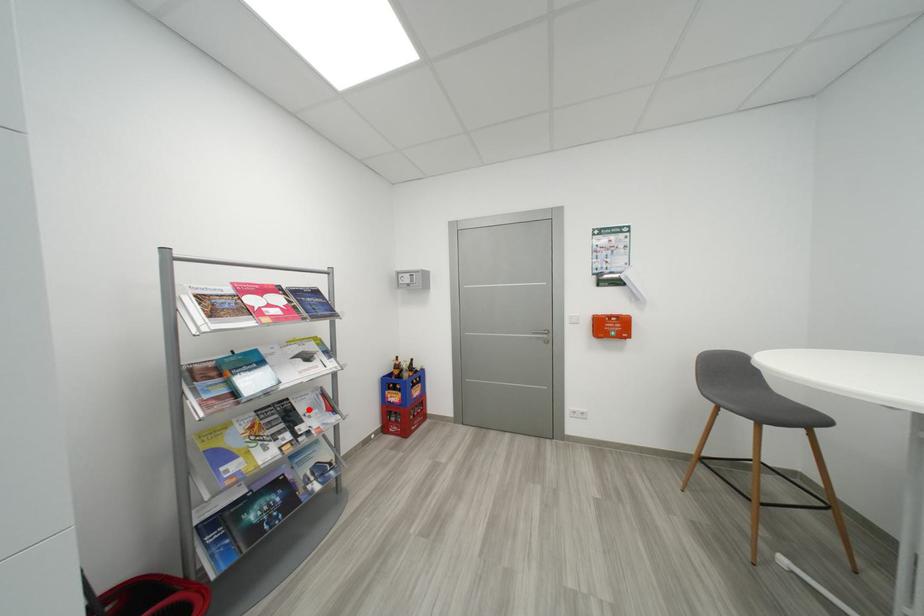
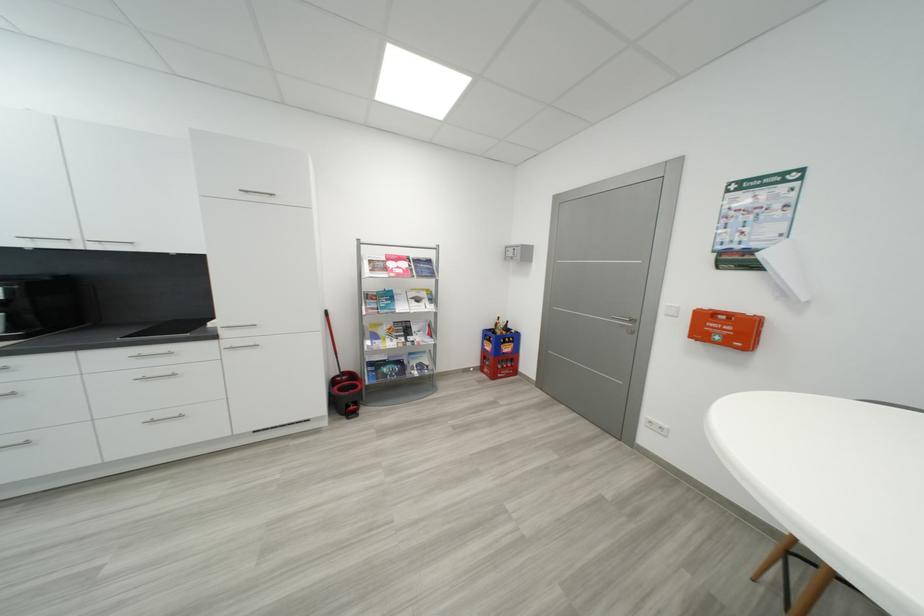
Question: I am providing you with two images of the same scene from different viewpoints. A red point is shown in image1. For the corresponding object point in image2, is it positioned nearer or farther from the camera?

Choices:
 (A) Nearer
 (B) Farther

Answer: (B)